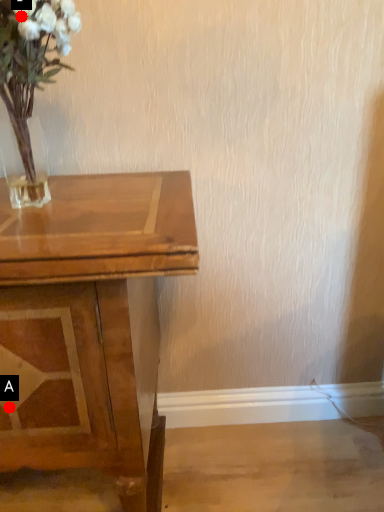
Question: Two points are circled on the image, labeled by A and B beside each circle. Which point appears farthest from the camera in this image?

Choices:
 (A) A is further
 (B) B is further

Answer: (A)